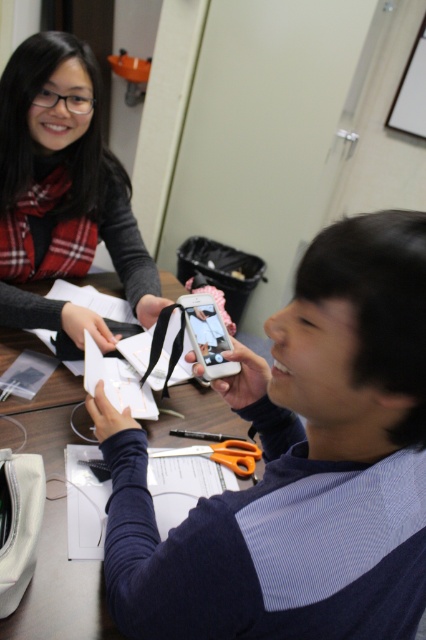
Question: Is plaid fabric scarf at upper left positioned at the back of orange plastic scissors at center?

Choices:
 (A) no
 (B) yes

Answer: (B)

Question: Which point is farther from the camera taking this photo?

Choices:
 (A) (51, 180)
 (B) (218, 458)

Answer: (A)

Question: Does plaid fabric scarf at upper left lie behind orange plastic scissors at center?

Choices:
 (A) no
 (B) yes

Answer: (B)

Question: Which object is farther from the camera taking this photo?

Choices:
 (A) plaid fabric scarf at upper left
 (B) orange plastic scissors at center

Answer: (A)

Question: Is plaid fabric scarf at upper left in front of orange plastic scissors at center?

Choices:
 (A) yes
 (B) no

Answer: (B)